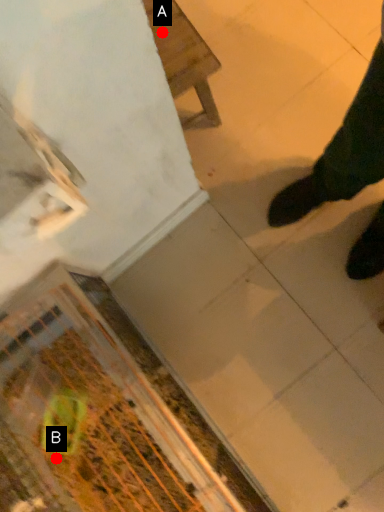
Question: Two points are circled on the image, labeled by A and B beside each circle. Among these points, which one is nearest to the camera?

Choices:
 (A) A is closer
 (B) B is closer

Answer: (A)